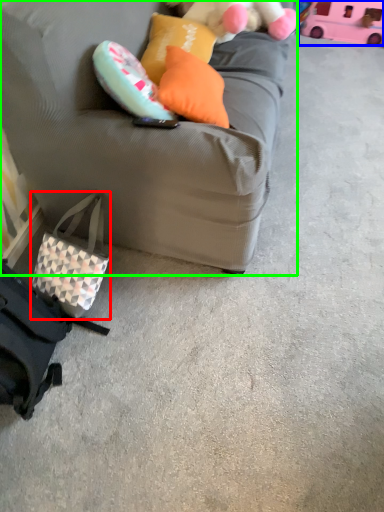
Question: Based on their relative distances, which object is nearer to pouch (highlighted by a red box)? Choose from toy (highlighted by a blue box) and studio couch (highlighted by a green box).

Choices:
 (A) toy
 (B) studio couch

Answer: (B)